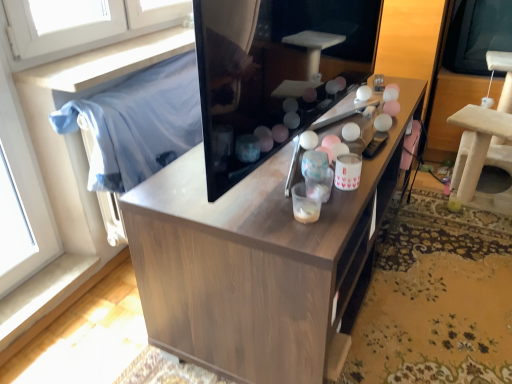
At what (x,y) coordinates should I click in order to perform the action: click on blue fabric at left. Please return your answer as a coordinate pair (x, y). The width and height of the screenshot is (512, 384). Looking at the image, I should click on (138, 123).

In order to click on beige carpeted cat tree at right in this screenshot , I will do `click(485, 143)`.

Between wooden cabinet at center and blue fabric at left, which one has smaller width?

blue fabric at left.

The height and width of the screenshot is (384, 512). In order to click on cloth above the wooden cabinet at center (from the image's perspective) in this screenshot , I will do (x=138, y=123).

From a real-world perspective, is wooden cabinet at center physically located above or below blue fabric at left?

In terms of real-world spatial position, wooden cabinet at center is below blue fabric at left.

Is wooden cabinet at center in contact with blue fabric at left?

No, wooden cabinet at center is not in contact with blue fabric at left.

From the image's perspective, relative to transparent plastic window screen at upper right, is blue fabric at left above or below?

Based on their image positions, blue fabric at left is located beneath transparent plastic window screen at upper right.

Looking at this image, from a real-world perspective, is blue fabric at left located beneath transparent plastic window screen at upper right?

Yes, from a real-world perspective, blue fabric at left is beneath transparent plastic window screen at upper right.

Is blue fabric at left not inside transparent plastic window screen at upper right?

Yes, blue fabric at left is outside of transparent plastic window screen at upper right.

Which object is closer to the camera, blue fabric at left or transparent plastic window screen at upper right?

blue fabric at left.

In terms of width, does transparent plastic window screen at upper right look wider or thinner when compared to blue fabric at left?

transparent plastic window screen at upper right is wider than blue fabric at left.

Is transparent plastic window screen at upper right aimed at blue fabric at left?

No, transparent plastic window screen at upper right is not oriented towards blue fabric at left.

From the image's perspective, which one is positioned lower, transparent plastic window screen at upper right or blue fabric at left?

From the image's view, blue fabric at left is below.

Which is in front, point (495, 25) or point (63, 125)?

Positioned in front is point (63, 125).

Considering their positions, is beige carpeted cat tree at right located in front of or behind wooden cabinet at center?

beige carpeted cat tree at right is positioned farther from the viewer than wooden cabinet at center.

Could you tell me if beige carpeted cat tree at right is facing wooden cabinet at center?

No, beige carpeted cat tree at right is not turned towards wooden cabinet at center.

Is beige carpeted cat tree at right positioned beyond the bounds of wooden cabinet at center?

Indeed, beige carpeted cat tree at right is completely outside wooden cabinet at center.

Considering the relative sizes of beige carpeted cat tree at right and wooden cabinet at center in the image provided, is beige carpeted cat tree at right bigger than wooden cabinet at center?

Incorrect, beige carpeted cat tree at right is not larger than wooden cabinet at center.

Can you confirm if blue fabric at left is positioned to the right of wooden cabinet at center?

In fact, blue fabric at left is to the left of wooden cabinet at center.

Considering the relative sizes of blue fabric at left and wooden cabinet at center in the image provided, is blue fabric at left smaller than wooden cabinet at center?

Indeed, blue fabric at left has a smaller size compared to wooden cabinet at center.

Based on the photo, is blue fabric at left not close to wooden cabinet at center?

blue fabric at left is near wooden cabinet at center, not far away.

Is the depth of blue fabric at left greater than that of wooden cabinet at center?

That is True.

From a real-world perspective, is blue fabric at left beneath beige carpeted cat tree at right?

Actually, blue fabric at left is physically above beige carpeted cat tree at right in the real world.

Who is bigger, blue fabric at left or beige carpeted cat tree at right?

beige carpeted cat tree at right.

Considering the sizes of blue fabric at left and beige carpeted cat tree at right in the image, is blue fabric at left taller or shorter than beige carpeted cat tree at right?

blue fabric at left is shorter than beige carpeted cat tree at right.

From the image's perspective, which object appears higher, blue fabric at left or beige carpeted cat tree at right?

beige carpeted cat tree at right appears higher in the image.

Between wooden cabinet at center and transparent plastic window screen at upper right, which one is positioned behind?

transparent plastic window screen at upper right.

Is wooden cabinet at center next to transparent plastic window screen at upper right and touching it?

No, wooden cabinet at center is not touching transparent plastic window screen at upper right.

Where is `window screen above the wooden cabinet at center (from a real-world perspective)`? Image resolution: width=512 pixels, height=384 pixels. window screen above the wooden cabinet at center (from a real-world perspective) is located at coordinates (477, 35).

Considering the relative sizes of wooden cabinet at center and transparent plastic window screen at upper right in the image provided, is wooden cabinet at center smaller than transparent plastic window screen at upper right?

No.

Where is `cloth lying above the wooden cabinet at center (from the image's perspective)`? This screenshot has height=384, width=512. cloth lying above the wooden cabinet at center (from the image's perspective) is located at coordinates (138, 123).

This screenshot has height=384, width=512. What are the coordinates of `window screen to the right of blue fabric at left` in the screenshot? It's located at (477, 35).

When comparing their distances from transparent plastic window screen at upper right, does wooden cabinet at center or beige carpeted cat tree at right seem closer?

beige carpeted cat tree at right lies closer to transparent plastic window screen at upper right than the other object.

From the image, which object appears to be nearer to blue fabric at left, beige carpeted cat tree at right or wooden cabinet at center?

Based on the image, wooden cabinet at center appears to be nearer to blue fabric at left.

Based on their spatial positions, is beige carpeted cat tree at right or blue fabric at left closer to wooden cabinet at center?

blue fabric at left is closer to wooden cabinet at center.

Considering their positions, is wooden cabinet at center positioned further to transparent plastic window screen at upper right than blue fabric at left?

blue fabric at left.

Which object lies nearer to the anchor point beige carpeted cat tree at right, blue fabric at left or transparent plastic window screen at upper right?

Among the two, transparent plastic window screen at upper right is located nearer to beige carpeted cat tree at right.

Looking at the image, which one is located further to blue fabric at left, transparent plastic window screen at upper right or beige carpeted cat tree at right?

transparent plastic window screen at upper right is positioned further to the anchor blue fabric at left.

Based on their spatial positions, is wooden cabinet at center or blue fabric at left further from beige carpeted cat tree at right?

blue fabric at left is further to beige carpeted cat tree at right.

Based on their spatial positions, is beige carpeted cat tree at right or blue fabric at left closer to transparent plastic window screen at upper right?

Among the two, beige carpeted cat tree at right is located nearer to transparent plastic window screen at upper right.

This screenshot has width=512, height=384. I want to click on furniture located between blue fabric at left and transparent plastic window screen at upper right in the left-right direction, so click(485, 143).

Where is `cabinetry between blue fabric at left and transparent plastic window screen at upper right from left to right`? The image size is (512, 384). cabinetry between blue fabric at left and transparent plastic window screen at upper right from left to right is located at coordinates (258, 262).

Where is `furniture between wooden cabinet at center and transparent plastic window screen at upper right along the z-axis`? furniture between wooden cabinet at center and transparent plastic window screen at upper right along the z-axis is located at coordinates (485, 143).

The height and width of the screenshot is (384, 512). In order to click on cabinetry located between blue fabric at left and beige carpeted cat tree at right in the left-right direction in this screenshot , I will do `click(258, 262)`.